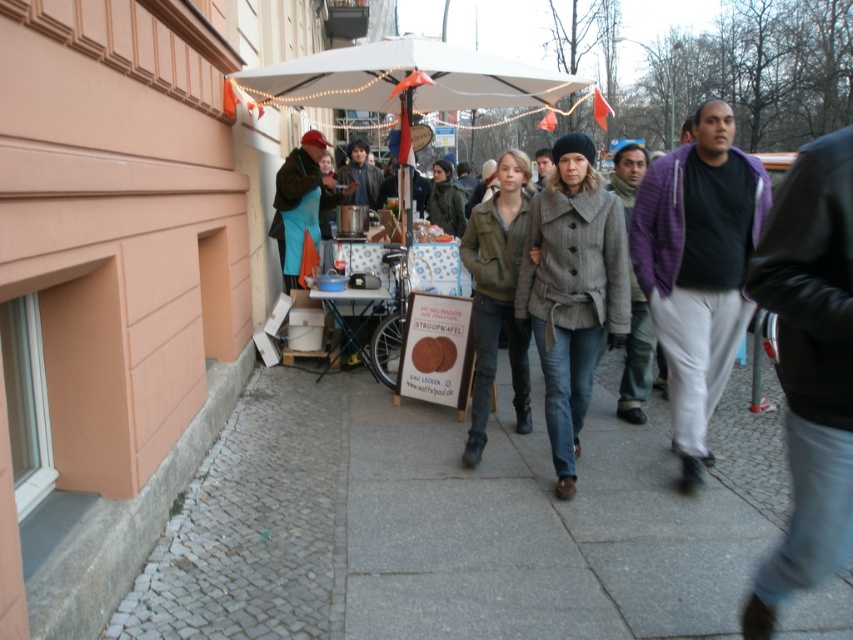
Which is more to the left, gray wool coat at center or purple fuzzy sweater at center?

Positioned to the left is gray wool coat at center.

Is gray wool coat at center positioned at the back of purple fuzzy sweater at center?

No, it is in front of purple fuzzy sweater at center.

Image resolution: width=853 pixels, height=640 pixels. What are the coordinates of `gray wool coat at center` in the screenshot? It's located at (572, 291).

Who is more forward, (688,368) or (631,189)?

Point (688,368) is in front.

Which is behind, point (659, 218) or point (653, 339)?

The point (653, 339) is more distant.

Is point (724, 278) farther from camera compared to point (618, 186)?

No, it is not.

Where is `purple knit sweater at center`? purple knit sweater at center is located at coordinates (698, 268).

Between gray cobblestone pavement at lower left and purple knit sweater at center, which one has less height?

gray cobblestone pavement at lower left

Measure the distance from gray cobblestone pavement at lower left to purple knit sweater at center.

The distance of gray cobblestone pavement at lower left from purple knit sweater at center is 4.49 feet.

Which is in front, point (595, 634) or point (685, 216)?

Point (595, 634) is more forward.

The image size is (853, 640). I want to click on gray cobblestone pavement at lower left, so click(x=456, y=522).